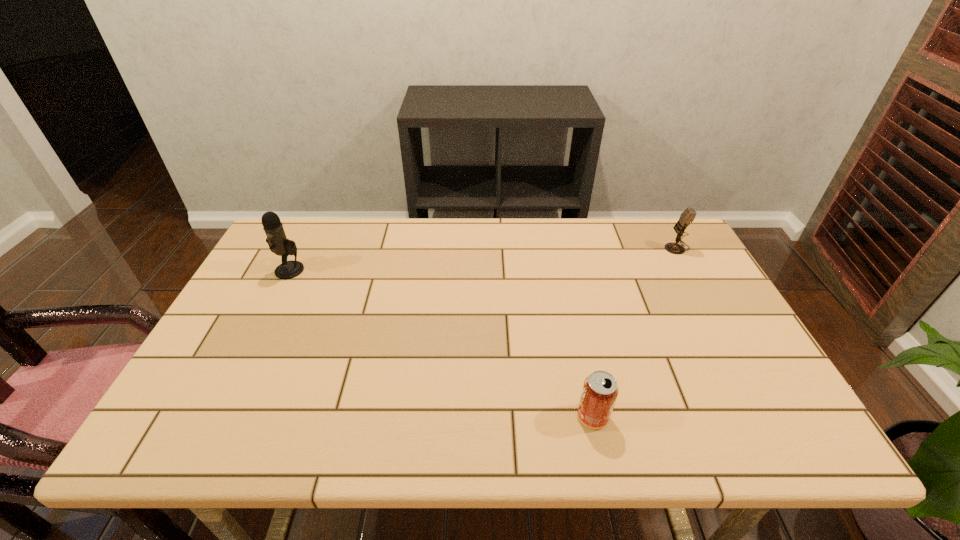
Where is `vacant area at the near left corner of the desktop`? vacant area at the near left corner of the desktop is located at coordinates (174, 437).

The image size is (960, 540). I want to click on vacant point located between the farthest object and the soda can, so click(635, 332).

Identify the location of free spot between the right microphone and the taller microphone. (483, 259).

Find the location of a particular element. This screenshot has width=960, height=540. free spot between the nearest object and the right microphone is located at coordinates (635, 332).

The width and height of the screenshot is (960, 540). In order to click on free space between the soda can and the taller microphone in this screenshot , I will do `click(442, 343)`.

At what (x,y) coordinates should I click in order to perform the action: click on vacant area that lies between the shorter microphone and the left microphone. Please return your answer as a coordinate pair (x, y). Image resolution: width=960 pixels, height=540 pixels. Looking at the image, I should click on [483, 259].

Locate an element on the screen. The width and height of the screenshot is (960, 540). unoccupied position between the rightmost object and the tallest object is located at coordinates (483, 259).

Locate an element on the screen. free space between the shorter microphone and the second nearest object is located at coordinates (483, 259).

The width and height of the screenshot is (960, 540). What are the coordinates of `vacant space that is in between the shorter microphone and the nearest object` in the screenshot? It's located at click(635, 332).

The width and height of the screenshot is (960, 540). I want to click on free space between the nearer microphone and the farther microphone, so point(483,259).